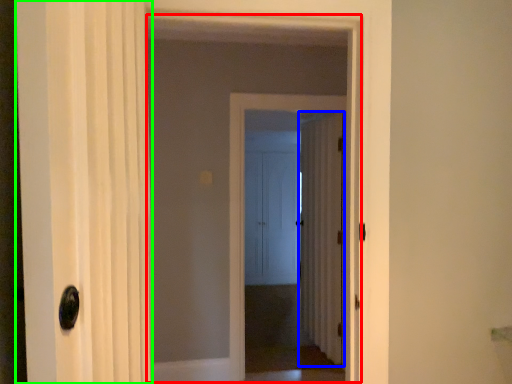
Question: Which is farther away from elevator (highlighted by a red box)? door (highlighted by a blue box) or door (highlighted by a green box)?

Choices:
 (A) door
 (B) door

Answer: (B)